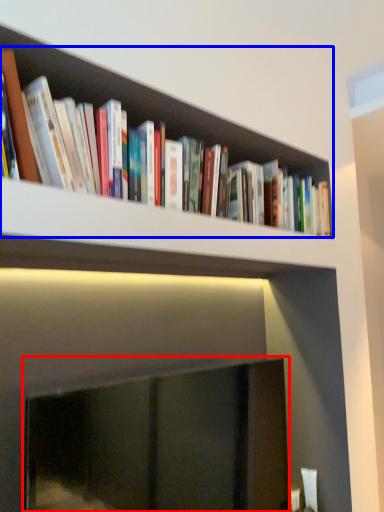
Question: Which object is closer to the camera taking this photo, fireplace (highlighted by a red box) or book (highlighted by a blue box)?

Choices:
 (A) fireplace
 (B) book

Answer: (A)